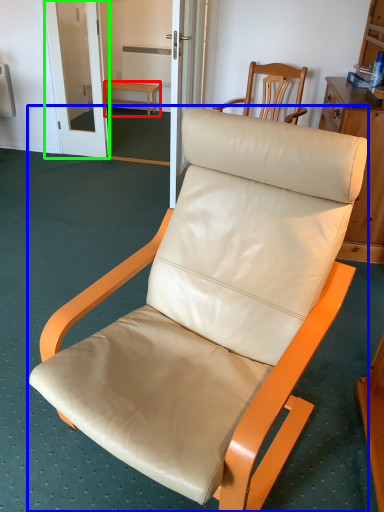
Question: Which object is positioned farthest from furniture (highlighted by a red box)? Select from chair (highlighted by a blue box) and screen door (highlighted by a green box).

Choices:
 (A) chair
 (B) screen door

Answer: (A)